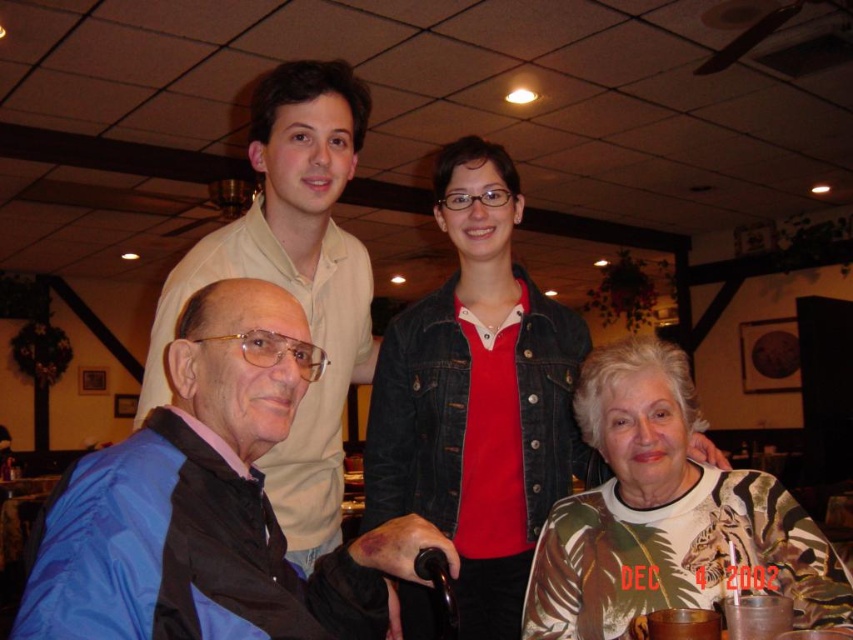
Question: Which is nearer to the blue fabric at lower left?

Choices:
 (A) denim jacket at upper center
 (B) printed fabric shirt at center

Answer: (B)

Question: Among these objects, which one is farthest from the camera?

Choices:
 (A) denim jacket at upper center
 (B) matte beige shirt at upper left

Answer: (A)

Question: Is printed fabric shirt at center above matte beige shirt at upper left?

Choices:
 (A) no
 (B) yes

Answer: (A)

Question: Is printed fabric shirt at center smaller than matte beige shirt at upper left?

Choices:
 (A) yes
 (B) no

Answer: (A)

Question: Which of the following is the closest to the observer?

Choices:
 (A) (108, 600)
 (B) (277, 499)
 (C) (605, 536)
 (D) (437, 454)

Answer: (A)

Question: Is denim jacket at upper center closer to the viewer compared to printed fabric shirt at center?

Choices:
 (A) yes
 (B) no

Answer: (B)